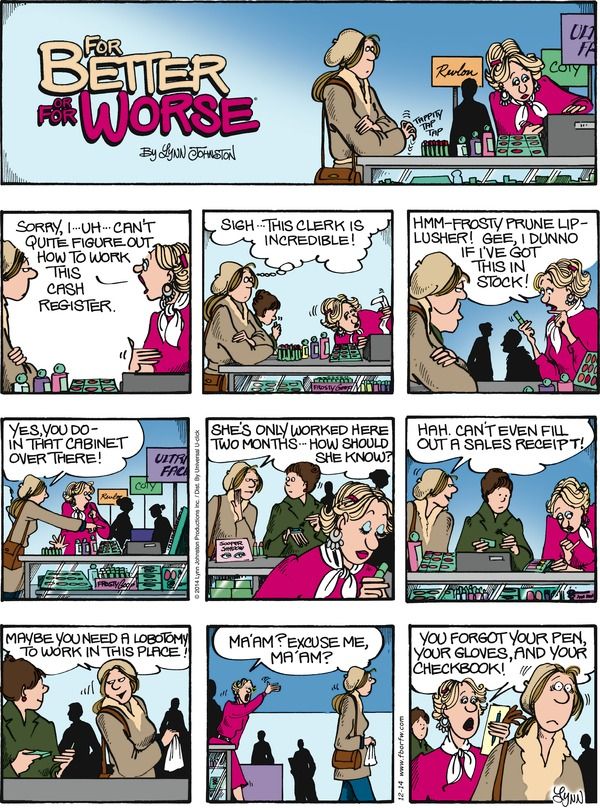
At what (x,y) coordinates should I click in order to perform the action: click on frame. Please return your answer as a coordinate pair (x, y). Image resolution: width=600 pixels, height=808 pixels. Looking at the image, I should click on (64, 718), (287, 697), (516, 696), (478, 494), (274, 505), (158, 511), (130, 271), (297, 278), (515, 279), (264, 69).